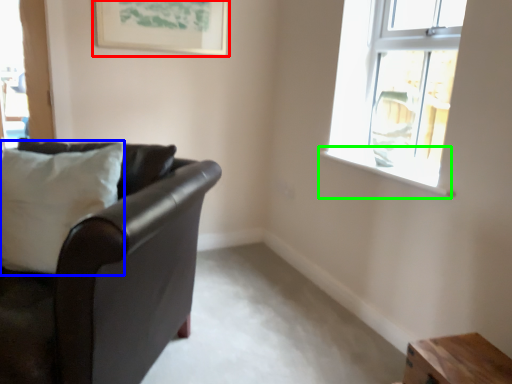
Question: Estimate the real-world distances between objects in this image. Which object is closer to picture frame (highlighted by a red box), pillow (highlighted by a blue box) or window sill (highlighted by a green box)?

Choices:
 (A) pillow
 (B) window sill

Answer: (A)